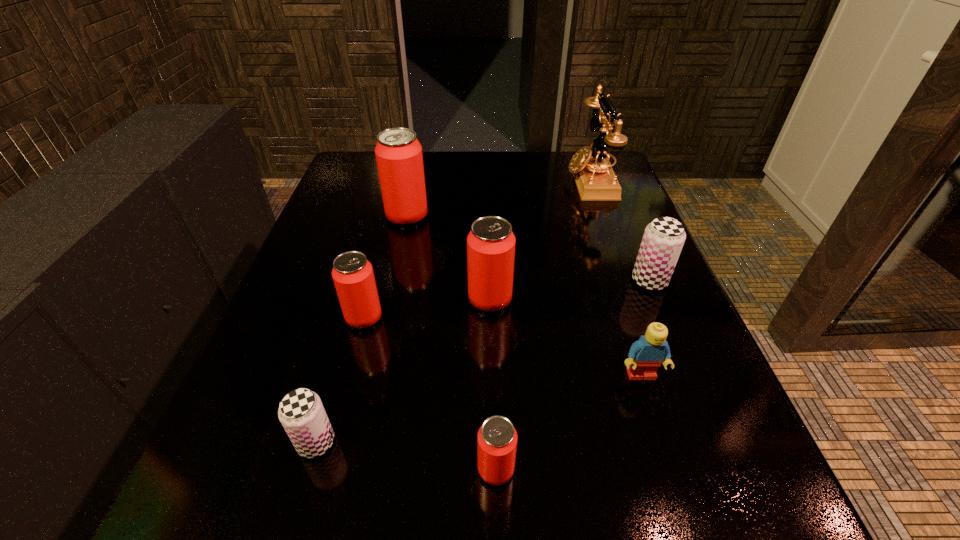
This screenshot has height=540, width=960. Identify the location of vacant space located on the face of the third nearest object. (666, 452).

Locate an element on the screen. Image resolution: width=960 pixels, height=540 pixels. free spot located 0.230m on the right of the smaller purple beer can is located at coordinates (500, 442).

The image size is (960, 540). Find the location of `blank space located on the back of the nearest red beer can`. blank space located on the back of the nearest red beer can is located at coordinates (491, 287).

At what (x,y) coordinates should I click in order to perform the action: click on object positioned at the far edge. Please return your answer as a coordinate pair (x, y). The image size is (960, 540). Looking at the image, I should click on (596, 181).

In order to click on object that is at the near edge in this screenshot , I will do `click(497, 438)`.

Image resolution: width=960 pixels, height=540 pixels. I want to click on telephone located at the right edge, so click(x=596, y=181).

Image resolution: width=960 pixels, height=540 pixels. In order to click on beer can located in the right edge section of the desktop in this screenshot , I will do `click(663, 239)`.

The height and width of the screenshot is (540, 960). I want to click on Lego present at the right edge, so click(645, 356).

Where is `object at the far right corner`? Image resolution: width=960 pixels, height=540 pixels. object at the far right corner is located at coordinates (596, 181).

You are a GUI agent. You are given a task and a screenshot of the screen. Output one action in this format:
    pyautogui.click(x=<x>, y=<y>)
    Task: Click on the free region at the far edge of the desktop
    This screenshot has width=960, height=540.
    Given the screenshot: What is the action you would take?
    pyautogui.click(x=450, y=179)